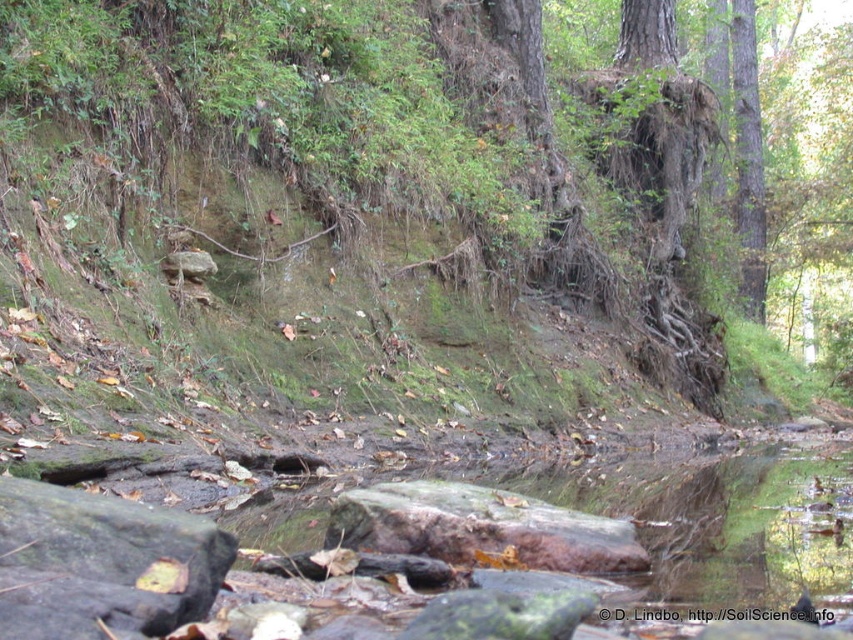
Between rusty wood log at center and green rough bark tree at right, which one is positioned lower?

rusty wood log at center is lower down.

Who is more distant from viewer, (361, 492) or (737, 77)?

The point (737, 77) is behind.

Identify the location of rusty wood log at center. (480, 529).

Can you confirm if green mossy rock at lower left is taller than rusty wood log at center?

Indeed, green mossy rock at lower left has a greater height compared to rusty wood log at center.

Can you confirm if green mossy rock at lower left is positioned below rusty wood log at center?

Incorrect, green mossy rock at lower left is not positioned below rusty wood log at center.

Which is in front, point (109, 548) or point (372, 528)?

Positioned in front is point (109, 548).

At what (x,y) coordinates should I click in order to perform the action: click on green mossy rock at lower left. Please return your answer as a coordinate pair (x, y). Looking at the image, I should click on (99, 563).

Between green mossy rock at lower left and green rough bark tree at right, which one appears on the right side from the viewer's perspective?

green rough bark tree at right is more to the right.

Locate an element on the screen. green mossy rock at lower left is located at coordinates click(99, 563).

You are a GUI agent. You are given a task and a screenshot of the screen. Output one action in this format:
    pyautogui.click(x=<x>, y=<y>)
    Task: Click on the green mossy rock at lower left
    Image resolution: width=853 pixels, height=640 pixels.
    Given the screenshot: What is the action you would take?
    pyautogui.click(x=99, y=563)